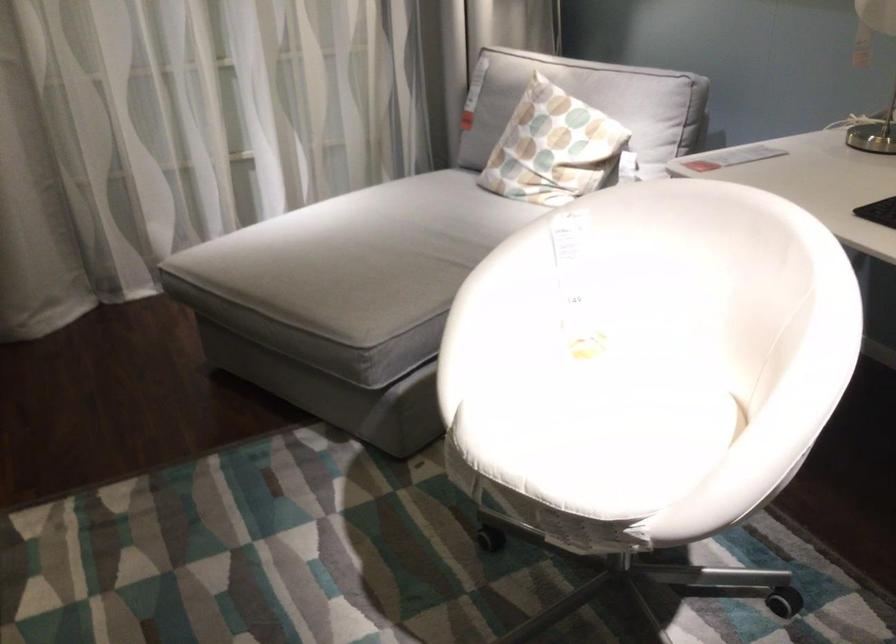
Describe the element at coordinates (359, 256) in the screenshot. I see `the grey sofa sitting surface` at that location.